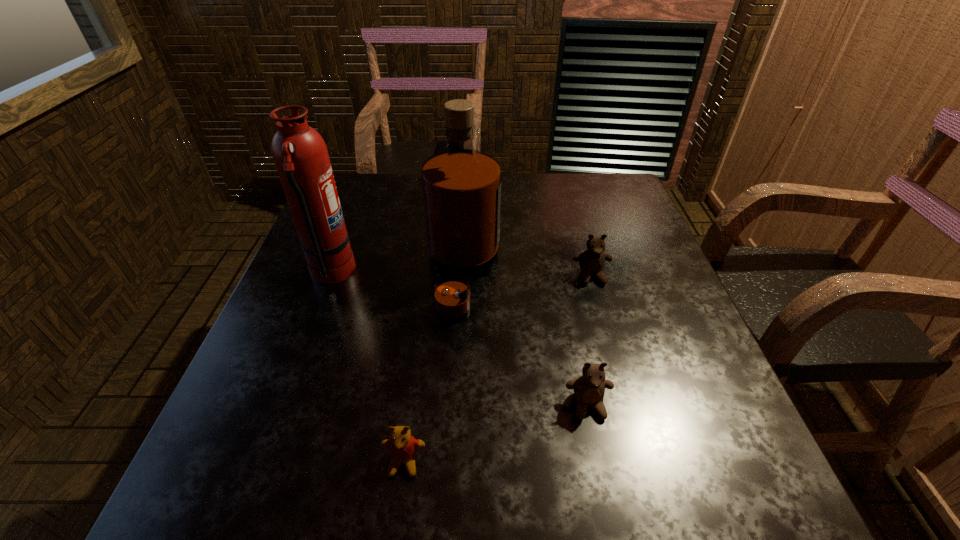
Where is `free point located 0.060m on the front-facing side of the shortest object`? This screenshot has height=540, width=960. free point located 0.060m on the front-facing side of the shortest object is located at coordinates (396, 520).

Find the location of a particular element. object at the near edge is located at coordinates (402, 446).

You are a GUI agent. You are given a task and a screenshot of the screen. Output one action in this format:
    pyautogui.click(x=<x>, y=<y>)
    Task: Click on the object at the left edge
    The image size is (960, 540).
    Given the screenshot: What is the action you would take?
    pyautogui.click(x=300, y=154)

Identify the location of object that is positioned at the right edge. (x=592, y=261).

Identify the location of vacant area at the far edge. The height and width of the screenshot is (540, 960). (528, 190).

In the image, there is a desktop. Identify the location of vacant space at the near edge. (462, 474).

This screenshot has width=960, height=540. In the image, there is a desktop. In order to click on free region at the left edge in this screenshot , I will do `click(363, 264)`.

You are a GUI agent. You are given a task and a screenshot of the screen. Output one action in this format:
    pyautogui.click(x=<x>, y=<y>)
    Task: Click on the free location at the right edge of the desktop
    The height and width of the screenshot is (540, 960).
    Given the screenshot: What is the action you would take?
    pyautogui.click(x=662, y=299)

Identify the location of free space at the near left corner of the desktop. The width and height of the screenshot is (960, 540). (230, 476).

At what (x,y) coordinates should I click in order to perform the action: click on free space between the leftmost object and the liquor. Please return your answer as a coordinate pair (x, y). Image resolution: width=960 pixels, height=540 pixels. Looking at the image, I should click on (397, 274).